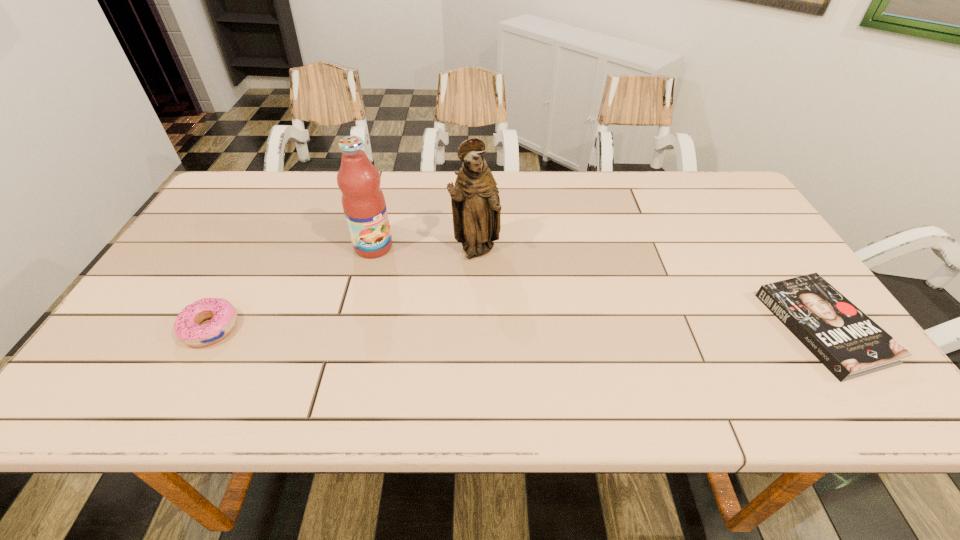
Locate an element on the screen. vacant space located 0.380m on the front label of the third object from right to left is located at coordinates (472, 346).

Locate an element on the screen. This screenshot has width=960, height=540. free space located on the front-facing side of the figurine is located at coordinates (556, 316).

In order to click on vacant space situated 0.080m on the front-facing side of the figurine in this screenshot , I will do `click(510, 276)`.

This screenshot has width=960, height=540. I want to click on vacant space located on the front-facing side of the figurine, so click(541, 303).

This screenshot has height=540, width=960. I want to click on doughnut at the near edge, so click(224, 316).

Locate an element on the screen. book that is at the near edge is located at coordinates (842, 337).

Locate an element on the screen. object that is positioned at the left edge is located at coordinates (224, 316).

Where is `object that is at the right edge`? The width and height of the screenshot is (960, 540). object that is at the right edge is located at coordinates (842, 337).

Find the location of a particular element. The width and height of the screenshot is (960, 540). object located in the near left corner section of the desktop is located at coordinates (224, 316).

Locate an element on the screen. object that is at the near right corner is located at coordinates (842, 337).